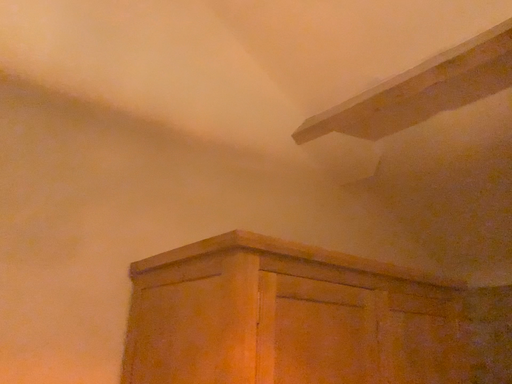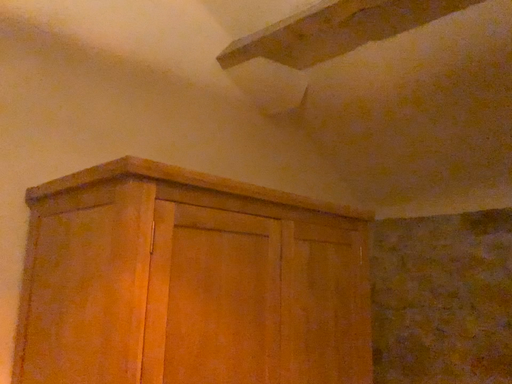
Question: How did the camera likely rotate when shooting the video?

Choices:
 (A) rotated downward
 (B) rotated upward

Answer: (A)